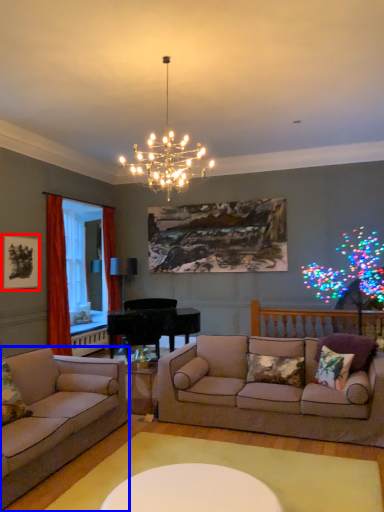
Question: Which of the following is the closest to the observer, picture frame (highlighted by a red box) or studio couch (highlighted by a blue box)?

Choices:
 (A) picture frame
 (B) studio couch

Answer: (B)